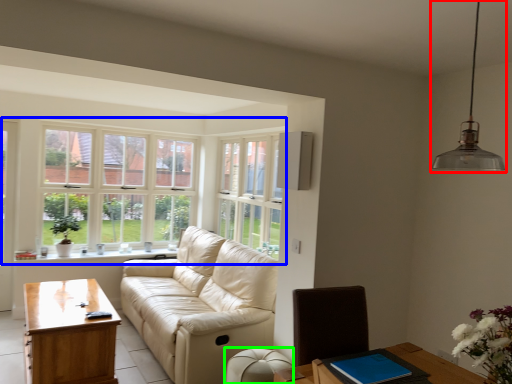
Question: Estimate the real-world distances between objects in this image. Which object is closer to light fixture (highlighted by a red box), window (highlighted by a blue box) or armchair (highlighted by a green box)?

Choices:
 (A) window
 (B) armchair

Answer: (B)